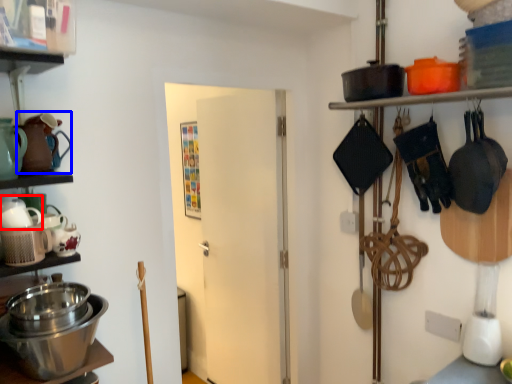
Question: Which object appears closest to the camera in this image, tea pot (highlighted by a red box) or tea pot (highlighted by a blue box)?

Choices:
 (A) tea pot
 (B) tea pot

Answer: (A)